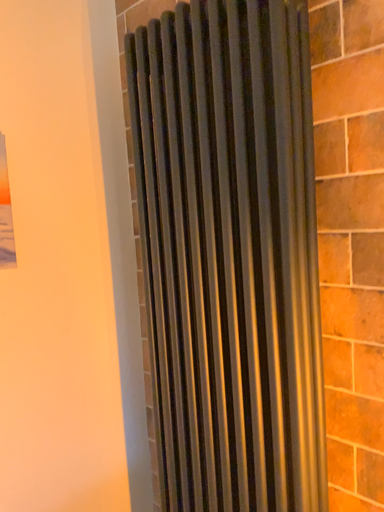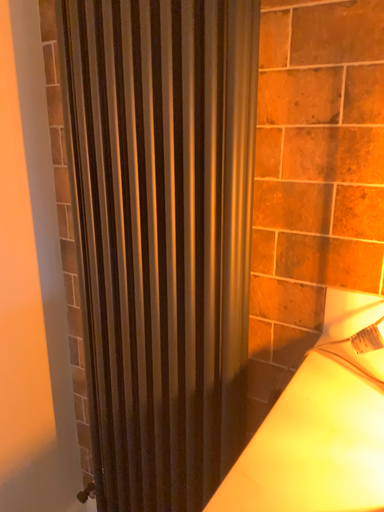
Question: How did the camera likely rotate when shooting the video?

Choices:
 (A) rotated right
 (B) rotated left

Answer: (A)